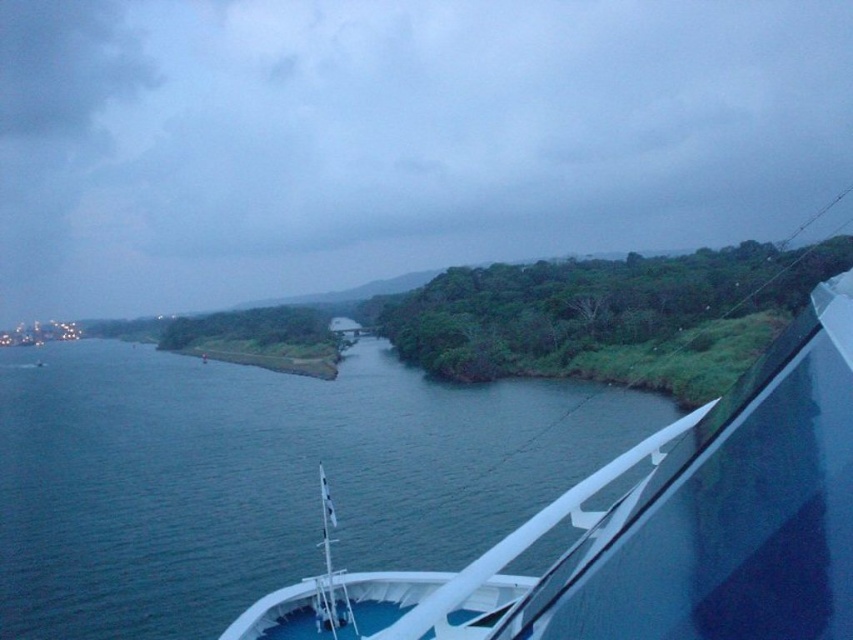
Question: Which of the following is the farthest from the observer?

Choices:
 (A) (357, 400)
 (B) (833, 417)

Answer: (A)

Question: Where is blue water at lower left located in relation to white glossy boat at center in the image?

Choices:
 (A) above
 (B) below

Answer: (B)

Question: Among these objects, which one is nearest to the camera?

Choices:
 (A) blue water at lower left
 (B) white glossy boat at center

Answer: (B)

Question: From the image, what is the correct spatial relationship of blue water at lower left in relation to white glossy boat at center?

Choices:
 (A) above
 (B) below

Answer: (B)

Question: Which object is farther from the camera taking this photo?

Choices:
 (A) white glossy boat at center
 (B) blue water at lower left

Answer: (B)

Question: Can you confirm if blue water at lower left is wider than white glossy boat at center?

Choices:
 (A) no
 (B) yes

Answer: (B)